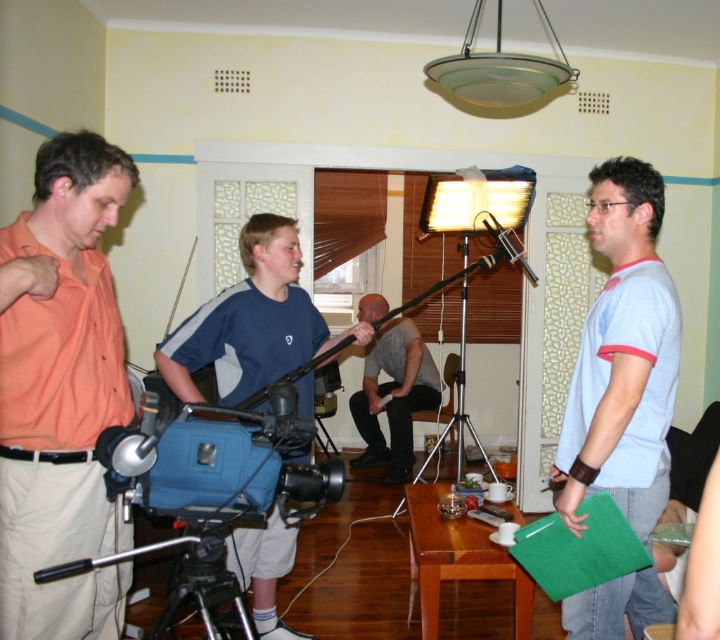
You are a photographer adjusting the focus on your camera. You need to focus on two points in the scene. The first point is at coordinates point (x=667, y=605) and the second is at point (x=198, y=545). Which point is closer to the camera lens?

Point (x=667, y=605) is further to the camera than point (x=198, y=545), so the second point at (x=198, y=545) is closer to the camera lens.